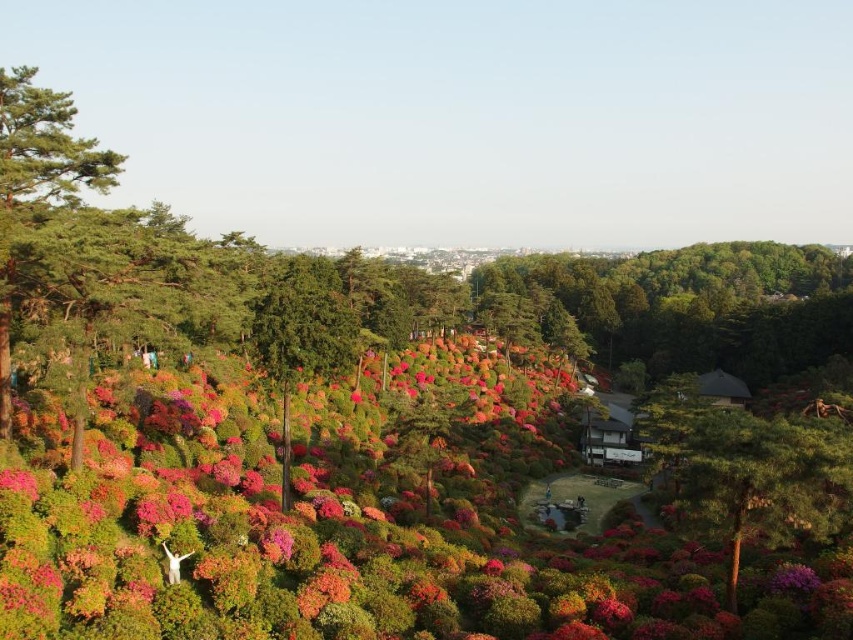
Does green textured tree at center-right have a lesser width compared to green rough bark tree at left?

No, green textured tree at center-right is not thinner than green rough bark tree at left.

Can you confirm if green textured tree at center-right is positioned above green rough bark tree at left?

No.

Is point (840, 483) positioned after point (4, 77)?

No, it is not.

Locate an element on the screen. This screenshot has width=853, height=640. green textured tree at center-right is located at coordinates (749, 470).

Describe the element at coordinates (749, 470) in the screenshot. I see `green textured tree at center-right` at that location.

Which is behind, point (759, 448) or point (280, 364)?

Positioned behind is point (280, 364).

Where is `green textured tree at center-right`? green textured tree at center-right is located at coordinates (749, 470).

How much distance is there between green rough bark tree at left and green matte tree at center?

green rough bark tree at left is 26.21 meters away from green matte tree at center.

Between green rough bark tree at left and green matte tree at center, which one has more height?

Standing taller between the two is green rough bark tree at left.

What do you see at coordinates (36, 182) in the screenshot? I see `green rough bark tree at left` at bounding box center [36, 182].

Find the location of `green rough bark tree at left`. green rough bark tree at left is located at coordinates (36, 182).